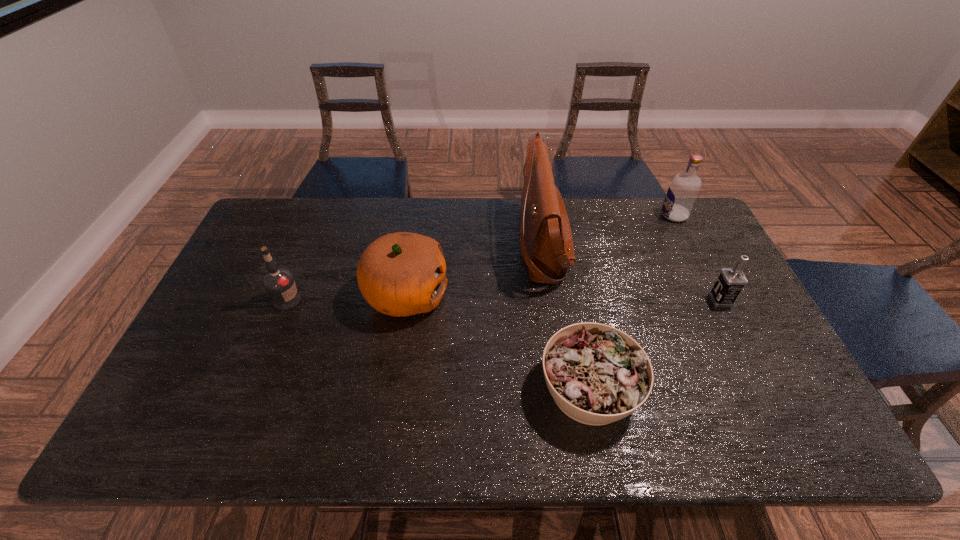
The height and width of the screenshot is (540, 960). In order to click on the tallest object in this screenshot , I will do `click(549, 251)`.

Locate an element on the screen. the farthest vodka is located at coordinates (683, 190).

Locate an element on the screen. The image size is (960, 540). the leftmost vodka is located at coordinates tap(279, 283).

You are a GUI agent. You are given a task and a screenshot of the screen. Output one action in this format:
    pyautogui.click(x=<x>, y=<y>)
    Task: Click on the second object from left to right
    
    Given the screenshot: What is the action you would take?
    pyautogui.click(x=400, y=274)

This screenshot has width=960, height=540. In order to click on the second shortest object in this screenshot , I will do `click(731, 281)`.

This screenshot has width=960, height=540. I want to click on salad, so click(x=597, y=374).

Identify the location of the shortest object. (597, 374).

This screenshot has width=960, height=540. What are the coordinates of `free location located on the front flap of the tallest object` in the screenshot? It's located at (405, 244).

Locate an element on the screen. The height and width of the screenshot is (540, 960). vacant position located on the front flap of the tallest object is located at coordinates (398, 244).

Where is `free spot located 0.360m on the front flap of the tallest object`? free spot located 0.360m on the front flap of the tallest object is located at coordinates (405, 244).